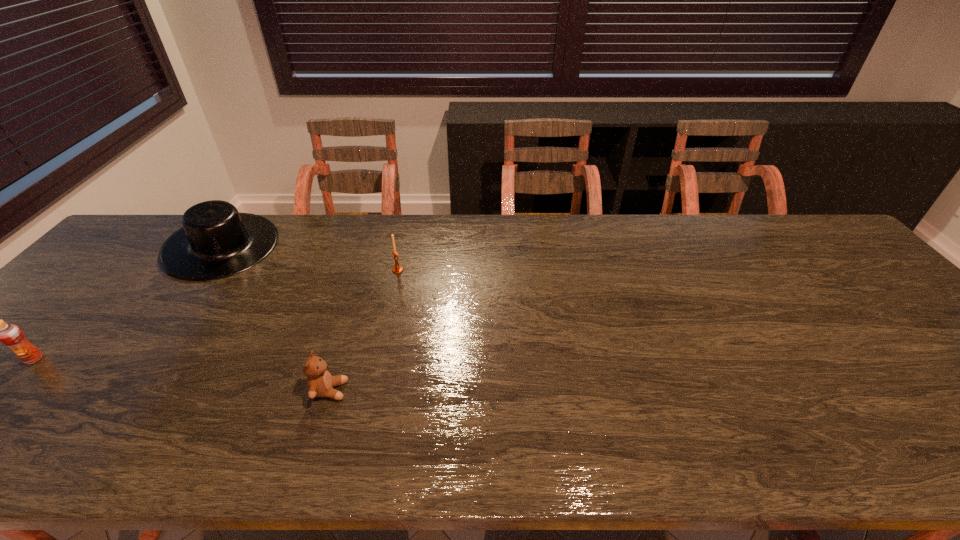
Locate an element on the screen. object that is at the far edge is located at coordinates (216, 241).

The width and height of the screenshot is (960, 540). I want to click on dress hat situated at the left edge, so click(x=216, y=241).

At what (x,y) coordinates should I click in order to perform the action: click on orange juice positioned at the left edge. Please return your answer as a coordinate pair (x, y). Looking at the image, I should click on (11, 335).

At what (x,y) coordinates should I click in order to perform the action: click on object situated at the far left corner. Please return your answer as a coordinate pair (x, y). Looking at the image, I should click on (216, 241).

Identify the location of vacant region at the far edge of the desktop. (421, 247).

In the image, there is a desktop. Where is `vacant space at the near edge`? The width and height of the screenshot is (960, 540). vacant space at the near edge is located at coordinates (516, 447).

What are the coordinates of `vacant space at the far right corner of the desktop` in the screenshot? It's located at (789, 236).

Where is `free space between the third farthest object and the third object from right to left`? free space between the third farthest object and the third object from right to left is located at coordinates (129, 303).

Image resolution: width=960 pixels, height=540 pixels. I want to click on blank region between the orange juice and the nearest object, so click(x=181, y=375).

Where is `empty space between the teddy bear and the dress hat`? empty space between the teddy bear and the dress hat is located at coordinates (276, 319).